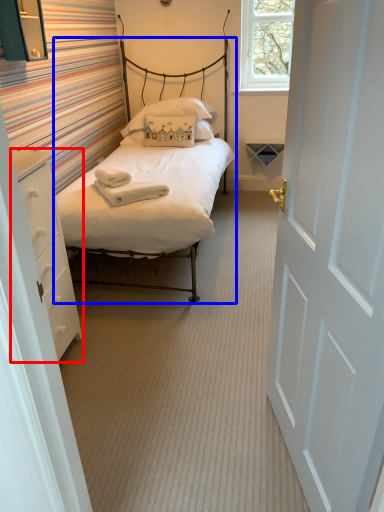
Question: Which object is further to the camera taking this photo, nightstand (highlighted by a red box) or bed (highlighted by a blue box)?

Choices:
 (A) nightstand
 (B) bed

Answer: (B)